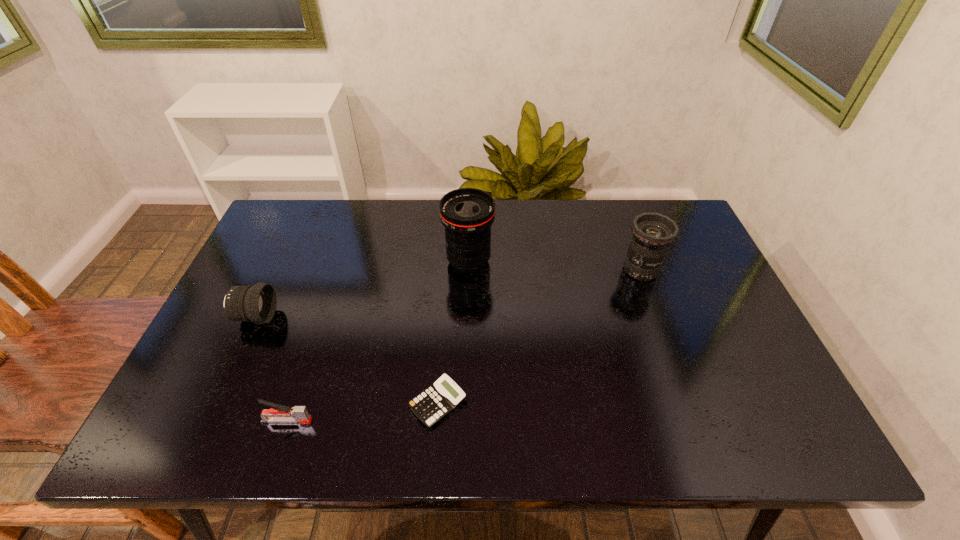
Identify the location of free space that satisfies the following two spatial constraints: 1. at the front element of the shortest telephoto lens; 2. on the left side of the calculator. (216, 403).

Identify the location of free space that satisfies the following two spatial constraints: 1. on the front side of the tallest telephoto lens; 2. at the front element of the leftmost object. This screenshot has width=960, height=540. (468, 317).

Locate an element on the screen. The image size is (960, 540). free point that satisfies the following two spatial constraints: 1. on the front side of the calculator; 2. on the handle side of the second object from left to right is located at coordinates (437, 421).